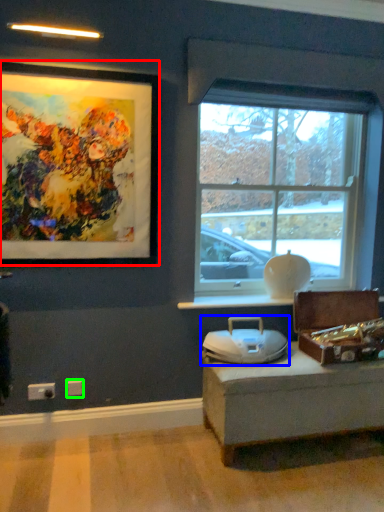
Question: Based on their relative distances, which object is farther from picture frame (highlighted by a red box)? Choose from swivel chair (highlighted by a blue box) and electric outlet (highlighted by a green box).

Choices:
 (A) swivel chair
 (B) electric outlet

Answer: (B)